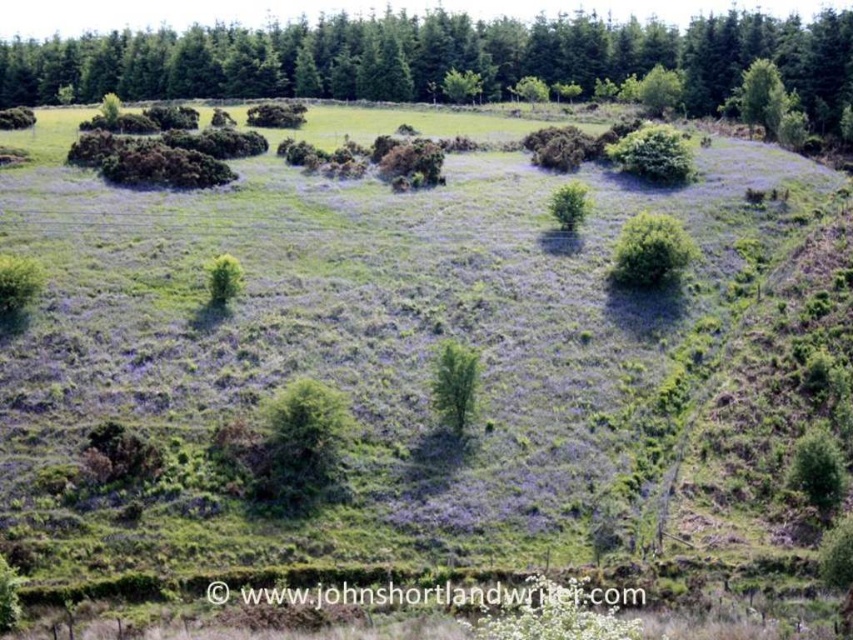
You are standing at the point marked by the coordinates point [650,250] in the image. What is the immediate object beneath your feet?

The point [650,250] is on a green leafy bush at center, so the immediate object beneath your feet is the green leafy bush at center.

You are standing in the field of purple flowers and see the point marked as point (438,58). What is the nearest object to this point?

The nearest object to point (438,58) is the green leafy tree at upper center because it is represented by that coordinate.

You are standing at the point marked as point (438, 58) in the image. What object is located at that point?

The point (438, 58) corresponds to a green leafy tree at upper center.